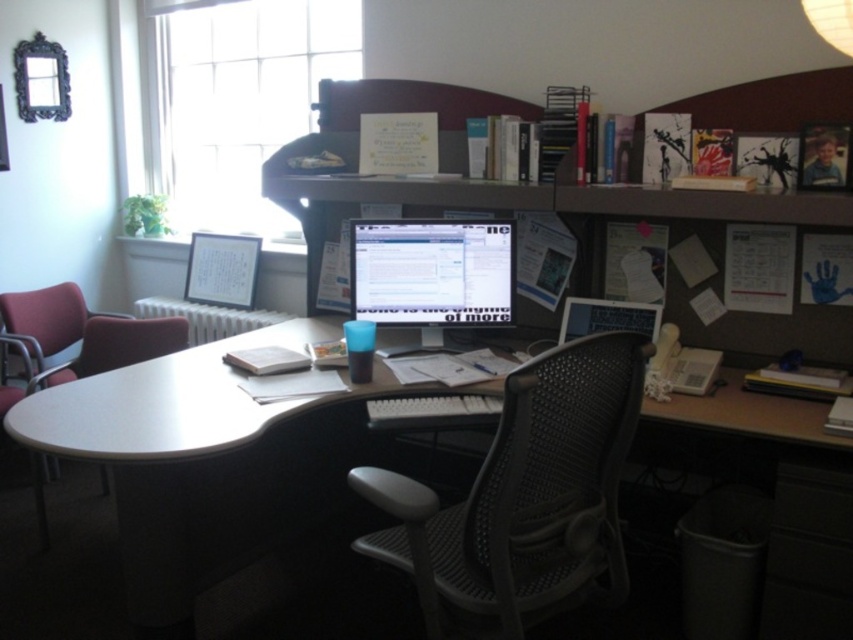
Does black mesh swivel chair at center have a greater width compared to fabric padded chair at left?

No.

Is black mesh swivel chair at center below fabric padded chair at left?

Yes.

Between point (442, 563) and point (181, 317), which one is positioned in front?

Point (442, 563) is in front.

At what (x,y) coordinates should I click in order to perform the action: click on black mesh swivel chair at center. Please return your answer as a coordinate pair (x, y). Image resolution: width=853 pixels, height=640 pixels. Looking at the image, I should click on (524, 497).

Can you confirm if clear glass window at upper left is wider than matte plastic monitor at center?

Yes.

Between point (252, 225) and point (511, 250), which one is positioned in front?

Point (511, 250) is more forward.

Who is more forward, (x=154, y=136) or (x=440, y=284)?

Point (x=440, y=284)

This screenshot has height=640, width=853. In order to click on clear glass window at upper left in this screenshot , I will do `click(236, 102)`.

Does black mesh swivel chair at center have a larger size compared to clear glass window at upper left?

Incorrect, black mesh swivel chair at center is not larger than clear glass window at upper left.

Can you confirm if black mesh swivel chair at center is thinner than clear glass window at upper left?

Yes.

Identify the location of black mesh swivel chair at center. The image size is (853, 640). (524, 497).